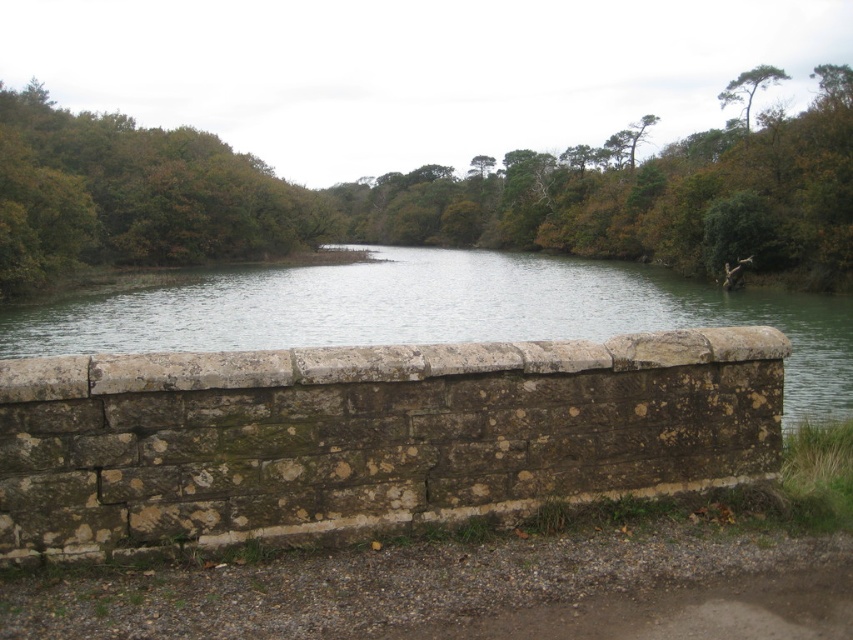
You are standing on the stone wall in the scene and want to look at both the green leafy tree at center and the greenish stone river at center. Which one will you need to look up more to see?

The green leafy tree at center is taller than the greenish stone river at center, so you will need to look up more to see the green leafy tree at center.

You are standing at the edge of the water and want to walk directly to the green leafy tree at center. According to the coordinates provided, in which direction should you head?

The green leafy tree at center is located at coordinates (427, 196). Since you are at the edge of the water, you should head towards the center of the scene where the tree is positioned.